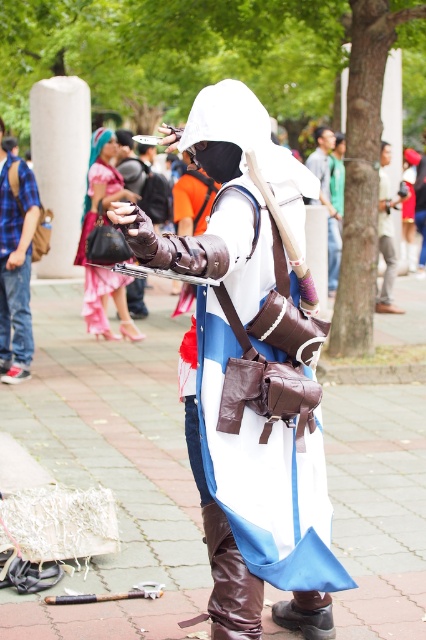
Which is more to the right, brown leather pants at center or brown leather backpack at center?

brown leather pants at center

Locate an element on the screen. This screenshot has width=426, height=640. brown leather pants at center is located at coordinates (386, 230).

How much distance is there between white leather gloves at center and brown leather pants at center?

They are 29.71 feet apart.

Does point (265, 214) come in front of point (383, 310)?

Yes, point (265, 214) is in front of point (383, 310).

Who is more forward, (267, 378) or (386, 196)?

Point (267, 378) is more forward.

I want to click on white leather gloves at center, so click(x=253, y=374).

Does white leather gloves at center lie in front of brushed metal backpack at left?

Yes, white leather gloves at center is in front of brushed metal backpack at left.

Does white leather gloves at center have a smaller size compared to brushed metal backpack at left?

No.

Between point (120, 204) and point (14, 282), which one is positioned in front?

Positioned in front is point (120, 204).

Where is `white leather gloves at center`? This screenshot has width=426, height=640. white leather gloves at center is located at coordinates (253, 374).